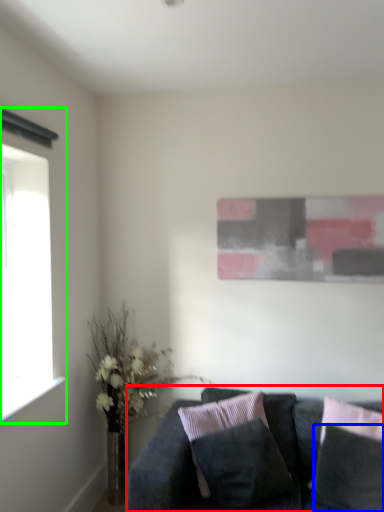
Question: Based on their relative distances, which object is farther from studio couch (highlighted by a red box)? Choose from pillow (highlighted by a blue box) and window (highlighted by a green box).

Choices:
 (A) pillow
 (B) window

Answer: (B)